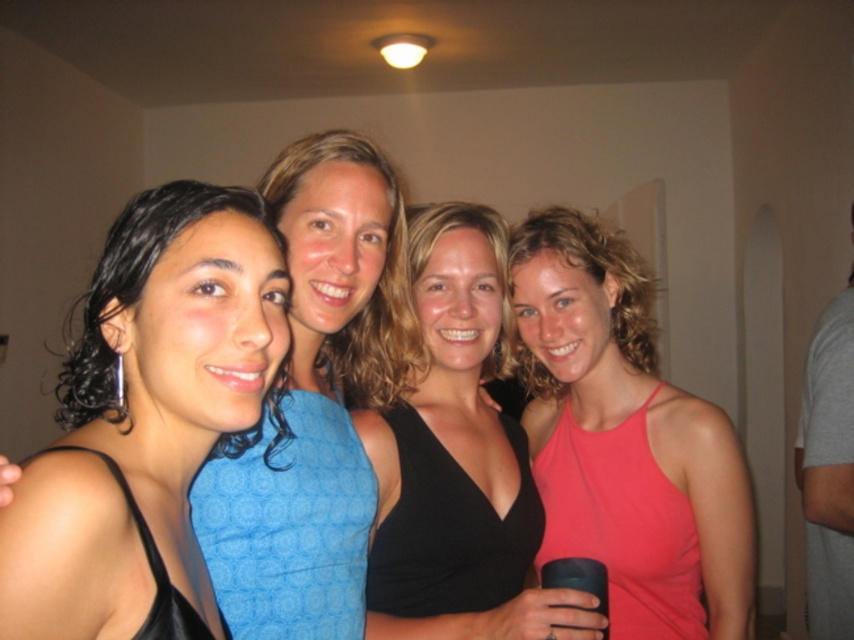
Question: Does pink matte tank top at center lie in front of gray cotton t-shirt at right?

Choices:
 (A) no
 (B) yes

Answer: (B)

Question: Which of the following is the farthest from the observer?

Choices:
 (A) (366, 595)
 (B) (531, 228)
 (C) (32, 554)

Answer: (B)

Question: Is pink matte tank top at center to the left of gray cotton t-shirt at right from the viewer's perspective?

Choices:
 (A) no
 (B) yes

Answer: (B)

Question: Does pink matte tank top at center have a smaller size compared to black matte cup at lower center?

Choices:
 (A) no
 (B) yes

Answer: (A)

Question: Among these points, which one is farthest from the camera?

Choices:
 (A) (822, 364)
 (B) (550, 566)
 (C) (104, 605)
 (D) (651, 371)

Answer: (D)

Question: Which of the following is the closest to the observer?

Choices:
 (A) (42, 625)
 (B) (525, 337)

Answer: (A)